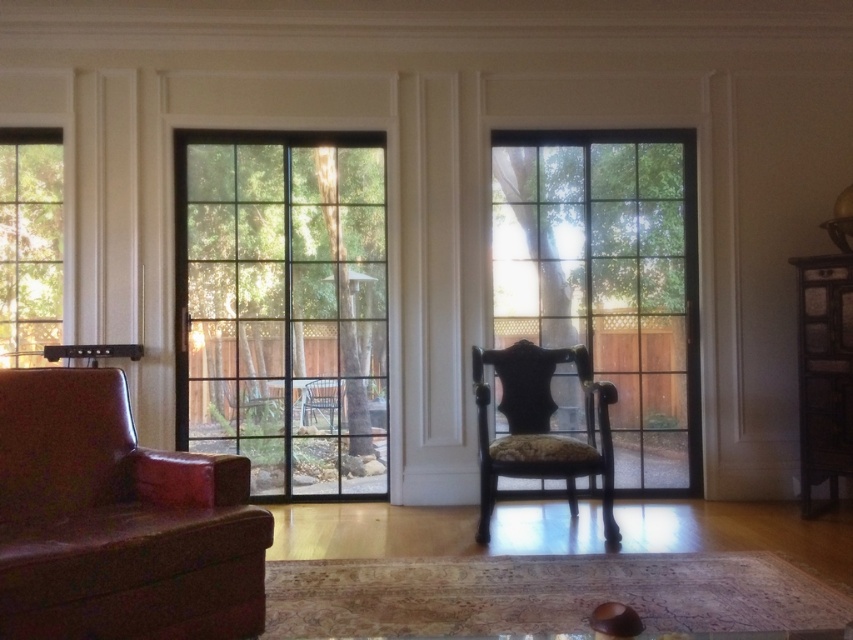
Between clear glass window at center and dark wood armchair at center, which one appears on the right side from the viewer's perspective?

Positioned to the right is clear glass window at center.

Between clear glass window at center and dark wood armchair at center, which one has more height?

clear glass window at center

Does point (596, 225) lie in front of point (482, 420)?

No, (596, 225) is behind (482, 420).

The image size is (853, 640). I want to click on clear glass window at center, so click(x=608, y=280).

Is clear glass screen door at center above clear glass window at center?

No.

Between clear glass screen door at center and clear glass window at center, which one appears on the left side from the viewer's perspective?

Positioned to the left is clear glass screen door at center.

Is point (361, 296) behind point (666, 458)?

No, (361, 296) is in front of (666, 458).

This screenshot has width=853, height=640. Find the location of `clear glass screen door at center`. clear glass screen door at center is located at coordinates (283, 305).

In order to click on leather armchair at left in this screenshot , I will do `click(117, 522)`.

Identify the location of leather armchair at left. The image size is (853, 640). (117, 522).